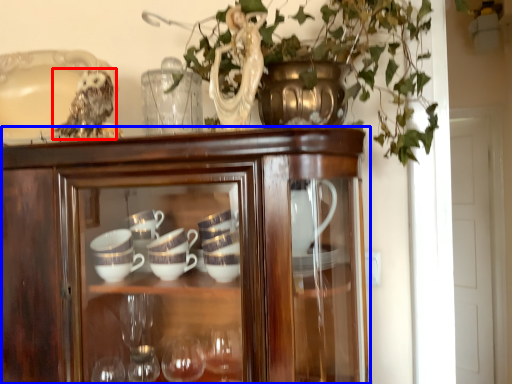
Question: Which object is further to the camera taking this photo, owl (highlighted by a red box) or cupboard (highlighted by a blue box)?

Choices:
 (A) owl
 (B) cupboard

Answer: (A)